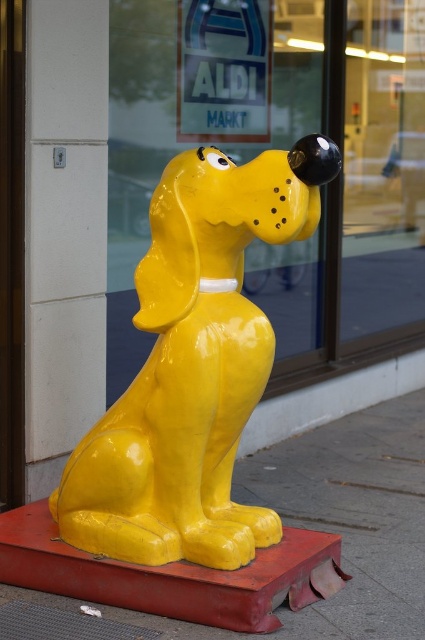
Question: Which object appears closest to the camera in this image?

Choices:
 (A) glossy glass shop window at upper center
 (B) glossy yellow dog at center

Answer: (B)

Question: Which of the following is the farthest from the observer?

Choices:
 (A) (382, 160)
 (B) (14, 600)

Answer: (A)

Question: Observing the image, what is the correct spatial positioning of matte yellow dog at center in reference to glossy yellow dog at center?

Choices:
 (A) right
 (B) left

Answer: (B)

Question: Does glossy glass shop window at upper center have a greater width compared to matte yellow dog at center?

Choices:
 (A) no
 (B) yes

Answer: (B)

Question: Based on their relative distances, which object is nearer to the matte yellow dog at center?

Choices:
 (A) glossy yellow dog at center
 (B) glossy glass shop window at upper center

Answer: (A)

Question: From the image, what is the correct spatial relationship of glossy glass shop window at upper center in relation to glossy yellow dog at center?

Choices:
 (A) left
 (B) right

Answer: (B)